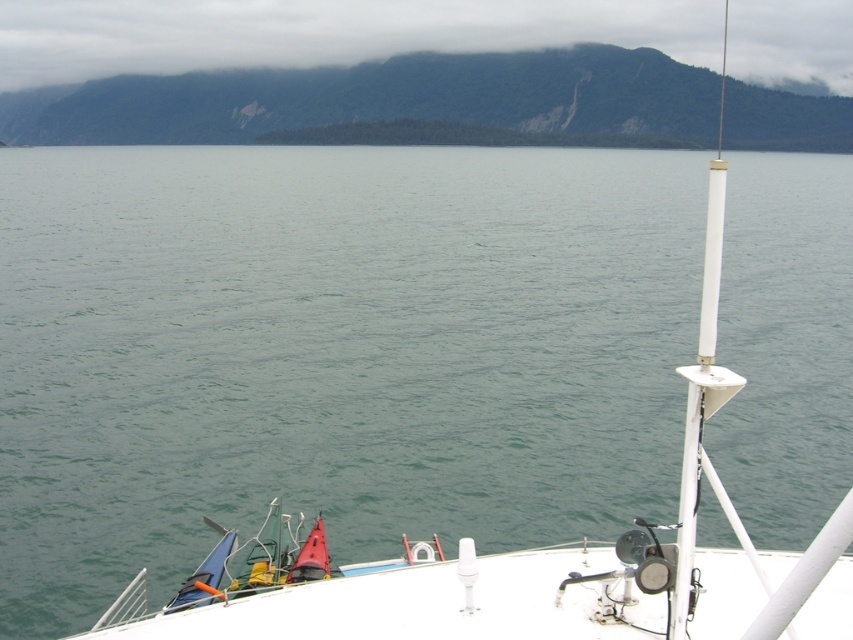
Question: Can you confirm if green forested mountain at upper center is smaller than cloudy fog at upper center?

Choices:
 (A) yes
 (B) no

Answer: (B)

Question: Is green forested mountain at upper center thinner than cloudy fog at upper center?

Choices:
 (A) yes
 (B) no

Answer: (A)

Question: Does green forested mountain at upper center come behind cloudy fog at upper center?

Choices:
 (A) no
 (B) yes

Answer: (A)

Question: Which object appears closest to the camera in this image?

Choices:
 (A) green forested mountain at upper center
 (B) cloudy fog at upper center

Answer: (A)